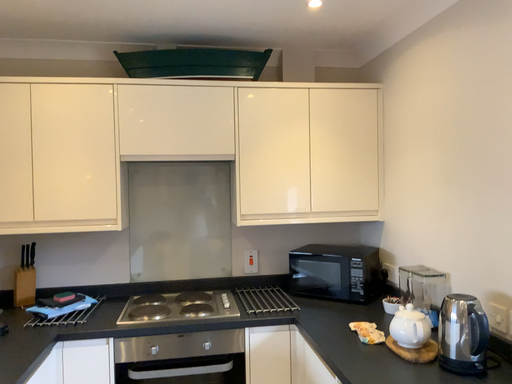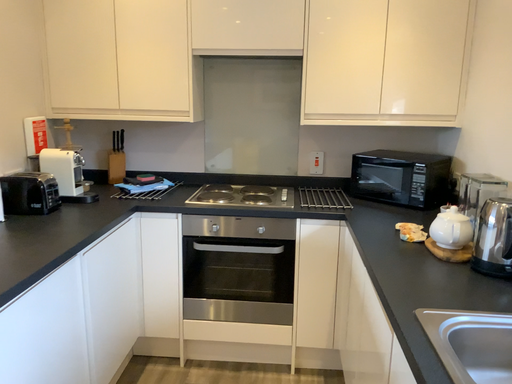
Question: Which way did the camera rotate in the video?

Choices:
 (A) rotated upward
 (B) rotated downward

Answer: (B)